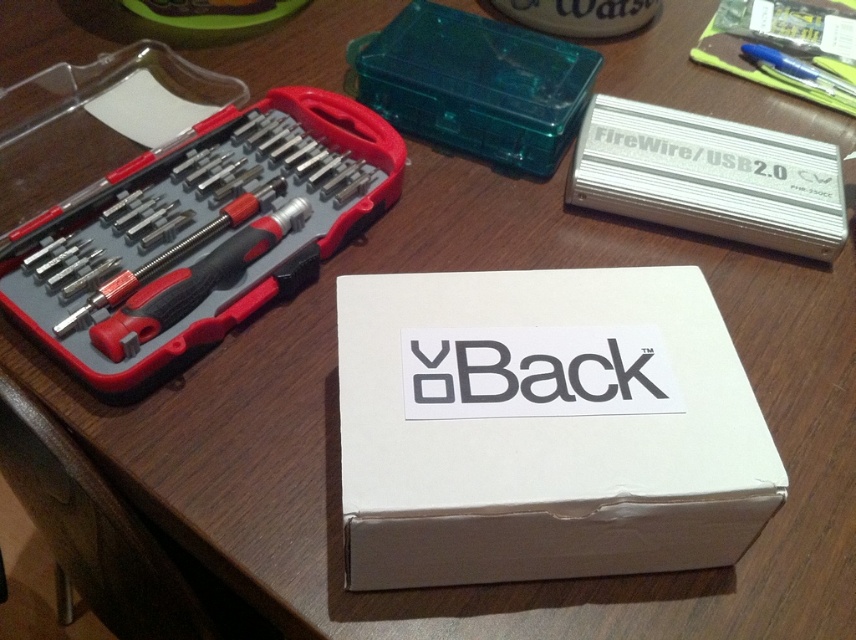
Question: Which object appears farthest from the camera in this image?

Choices:
 (A) silver metallic firewire/usb 20 at upper right
 (B) black plastic screwdriver set at left
 (C) white cardboard box at center

Answer: (A)

Question: Does black plastic screwdriver set at left appear under silver metallic firewire/usb 20 at upper right?

Choices:
 (A) yes
 (B) no

Answer: (A)

Question: Is silver metallic firewire/usb 20 at upper right below red plastic screwdriver at left?

Choices:
 (A) no
 (B) yes

Answer: (A)

Question: Which point appears farthest from the camera in this image?

Choices:
 (A) (522, 102)
 (B) (764, 448)

Answer: (A)

Question: Does transparent plastic case at upper center appear on the right side of red plastic screwdriver at left?

Choices:
 (A) no
 (B) yes

Answer: (B)

Question: Which of the following is the farthest from the observer?

Choices:
 (A) black plastic screwdriver set at left
 (B) red plastic screwdriver at left
 (C) silver metallic firewire/usb 20 at upper right

Answer: (C)